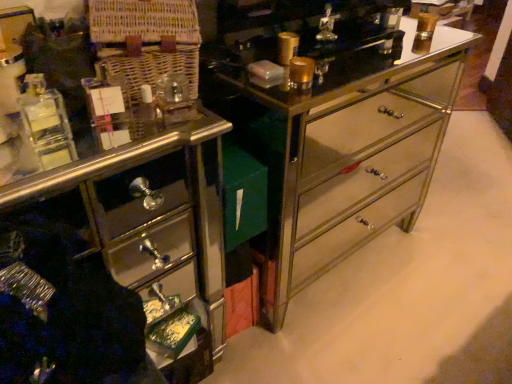
This screenshot has height=384, width=512. Describe the element at coordinates (343, 148) in the screenshot. I see `metallic mirrored dresser at center` at that location.

Measure the distance between metallic mirrored dresser at center and camera.

A distance of 35.85 inches exists between metallic mirrored dresser at center and camera.

I want to click on metallic mirrored dresser at center, so click(x=343, y=148).

Identify the location of shiny mirrored drawer at lower left. (113, 255).

What do you see at coordinates (113, 255) in the screenshot? I see `shiny mirrored drawer at lower left` at bounding box center [113, 255].

Where is `metallic mirrored dresser at center`? This screenshot has width=512, height=384. metallic mirrored dresser at center is located at coordinates (343, 148).

Considering the positions of objects shiny mirrored drawer at lower left and metallic mirrored dresser at center in the image provided, who is more to the left, shiny mirrored drawer at lower left or metallic mirrored dresser at center?

Positioned to the left is shiny mirrored drawer at lower left.

Is shiny mirrored drawer at lower left in front of metallic mirrored dresser at center?

Yes, shiny mirrored drawer at lower left is closer to the camera.

Between point (97, 305) and point (295, 147), which one is positioned behind?

The point (295, 147) is behind.

From the image's perspective, which one is positioned lower, shiny mirrored drawer at lower left or metallic mirrored dresser at center?

shiny mirrored drawer at lower left appears lower in the image.

From a real-world perspective, is shiny mirrored drawer at lower left positioned under metallic mirrored dresser at center based on gravity?

Actually, shiny mirrored drawer at lower left is physically above metallic mirrored dresser at center in the real world.

Is shiny mirrored drawer at lower left wider or thinner than metallic mirrored dresser at center?

shiny mirrored drawer at lower left is thinner than metallic mirrored dresser at center.

Who is shorter, shiny mirrored drawer at lower left or metallic mirrored dresser at center?

With less height is shiny mirrored drawer at lower left.

Considering the sizes of objects shiny mirrored drawer at lower left and metallic mirrored dresser at center in the image provided, who is bigger, shiny mirrored drawer at lower left or metallic mirrored dresser at center?

With larger size is metallic mirrored dresser at center.

Does shiny mirrored drawer at lower left contain metallic mirrored dresser at center?

Actually, metallic mirrored dresser at center is outside shiny mirrored drawer at lower left.

Is shiny mirrored drawer at lower left with metallic mirrored dresser at center?

No, shiny mirrored drawer at lower left is not next to metallic mirrored dresser at center.

Is shiny mirrored drawer at lower left oriented towards metallic mirrored dresser at center?

No.

Measure the distance from shiny mirrored drawer at lower left to metallic mirrored dresser at center.

shiny mirrored drawer at lower left and metallic mirrored dresser at center are 45.03 centimeters apart from each other.

This screenshot has height=384, width=512. I want to click on counter behind the shiny mirrored drawer at lower left, so click(343, 148).

Which object is positioned more to the right, metallic mirrored dresser at center or shiny mirrored drawer at lower left?

Positioned to the right is metallic mirrored dresser at center.

Is the depth of metallic mirrored dresser at center greater than that of shiny mirrored drawer at lower left?

Yes, metallic mirrored dresser at center is further from the camera.

Which is further, (374, 81) or (180, 253)?

Point (180, 253)

From the image's perspective, is metallic mirrored dresser at center above shiny mirrored drawer at lower left?

Yes, from the image's perspective, metallic mirrored dresser at center is above shiny mirrored drawer at lower left.

From a real-world perspective, which object rests below the other?

In real-world perspective, metallic mirrored dresser at center is lower.

Considering the relative sizes of metallic mirrored dresser at center and shiny mirrored drawer at lower left in the image provided, is metallic mirrored dresser at center wider than shiny mirrored drawer at lower left?

Yes.

Who is shorter, metallic mirrored dresser at center or shiny mirrored drawer at lower left?

With less height is shiny mirrored drawer at lower left.

Does metallic mirrored dresser at center have a smaller size compared to shiny mirrored drawer at lower left?

No.

Is metallic mirrored dresser at center surrounding shiny mirrored drawer at lower left?

Definitely not — shiny mirrored drawer at lower left is not inside metallic mirrored dresser at center.

Is there a large distance between metallic mirrored dresser at center and shiny mirrored drawer at lower left?

No, there isn't a large distance between metallic mirrored dresser at center and shiny mirrored drawer at lower left.

Is metallic mirrored dresser at center looking in the opposite direction of shiny mirrored drawer at lower left?

No, metallic mirrored dresser at center is not facing the opposite direction of shiny mirrored drawer at lower left.

What's the angular difference between metallic mirrored dresser at center and shiny mirrored drawer at lower left's facing directions?

0.00166 degrees.

The width and height of the screenshot is (512, 384). In order to click on chest of drawers above the metallic mirrored dresser at center (from a real-world perspective) in this screenshot , I will do `click(113, 255)`.

Locate an element on the screen. the chest of drawers in front of the metallic mirrored dresser at center is located at coordinates (113, 255).

At what (x,y) coordinates should I click in order to perform the action: click on the chest of drawers that is below the metallic mirrored dresser at center (from the image's perspective). Please return your answer as a coordinate pair (x, y). This screenshot has width=512, height=384. Looking at the image, I should click on (113, 255).